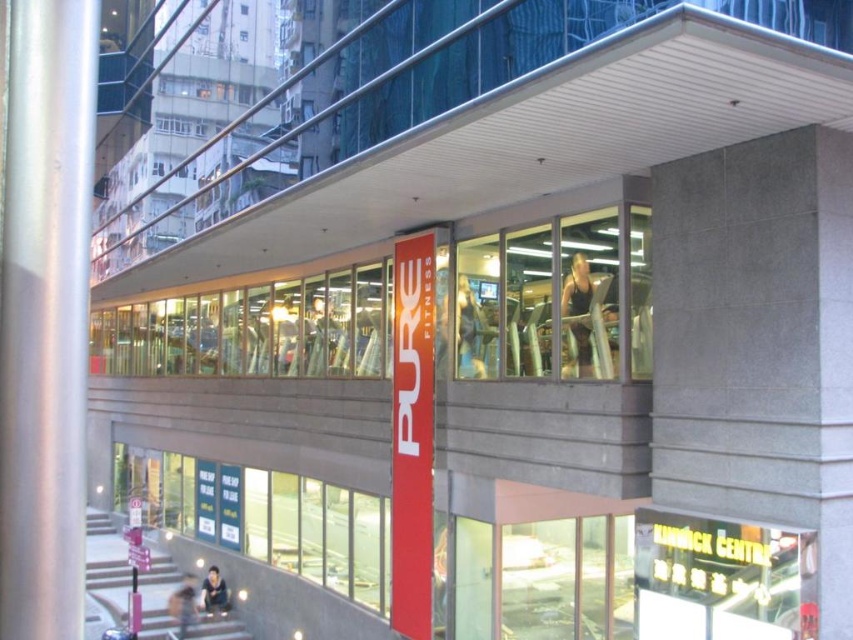
Is silver metallic pole at left smaller than dark gray fabric pants at lower center?

Indeed, silver metallic pole at left has a smaller size compared to dark gray fabric pants at lower center.

Based on the photo, is silver metallic pole at left bigger than dark gray fabric pants at lower center?

Actually, silver metallic pole at left might be smaller than dark gray fabric pants at lower center.

Who is more distant from viewer, [74,16] or [184,600]?

Positioned behind is point [184,600].

Locate an element on the screen. This screenshot has width=853, height=640. silver metallic pole at left is located at coordinates (45, 316).

Which is more to the right, dark gray fabric pants at lower center or dark blue fabric shirt at lower center?

From the viewer's perspective, dark blue fabric shirt at lower center appears more on the right side.

What do you see at coordinates (183, 605) in the screenshot? I see `dark gray fabric pants at lower center` at bounding box center [183, 605].

The width and height of the screenshot is (853, 640). In order to click on dark gray fabric pants at lower center in this screenshot , I will do pos(183,605).

Locate an element on the screen. The width and height of the screenshot is (853, 640). dark gray fabric pants at lower center is located at coordinates (183, 605).

Measure the distance between black matte tank top at center and camera.

black matte tank top at center and camera are 29.94 feet apart from each other.

Does point (592, 355) lie behind point (474, 332)?

No, (592, 355) is in front of (474, 332).

Does point (598, 321) come closer to viewer compared to point (465, 324)?

Yes.

You are a GUI agent. You are given a task and a screenshot of the screen. Output one action in this format:
    pyautogui.click(x=<x>, y=<y>)
    Task: Click on the black matte tank top at center
    Image resolution: width=853 pixels, height=640 pixels.
    Given the screenshot: What is the action you would take?
    pyautogui.click(x=589, y=317)